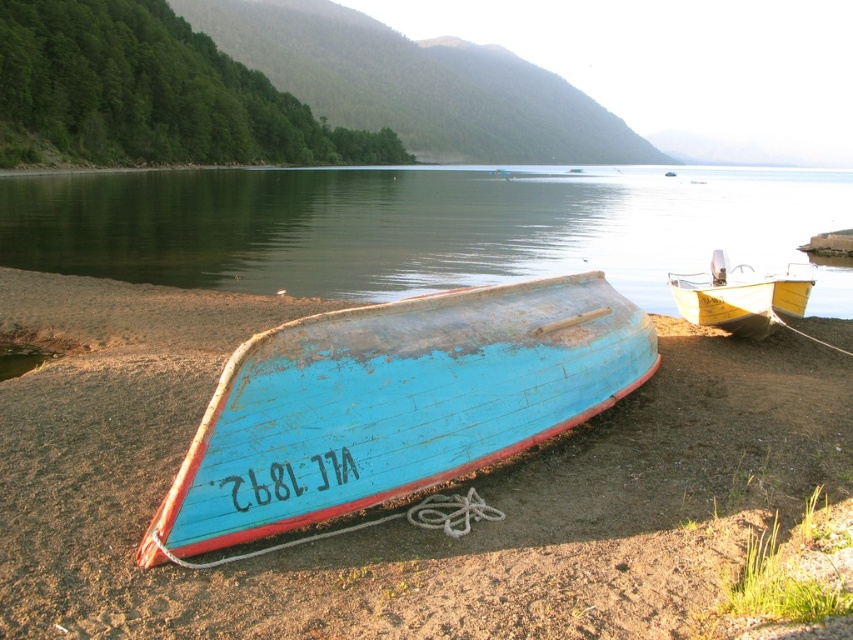
Based on the photo, is blue wooden boat at lower center positioned behind yellow wooden boat at center?

Yes, blue wooden boat at lower center is behind yellow wooden boat at center.

Based on the photo, does blue wooden boat at lower center appear under yellow wooden boat at center?

No, blue wooden boat at lower center is not below yellow wooden boat at center.

Locate an element on the screen. blue wooden boat at lower center is located at coordinates 410,225.

Is blue wooden boat at center further to the viewer compared to yellow wooden boat at center?

No, blue wooden boat at center is in front of yellow wooden boat at center.

The width and height of the screenshot is (853, 640). I want to click on blue wooden boat at center, so [x=395, y=403].

Which is more to the left, blue wooden boat at lower center or blue wooden boat at center?

blue wooden boat at center

This screenshot has width=853, height=640. I want to click on blue wooden boat at lower center, so click(410, 225).

Locate an element on the screen. This screenshot has width=853, height=640. blue wooden boat at lower center is located at coordinates (410, 225).